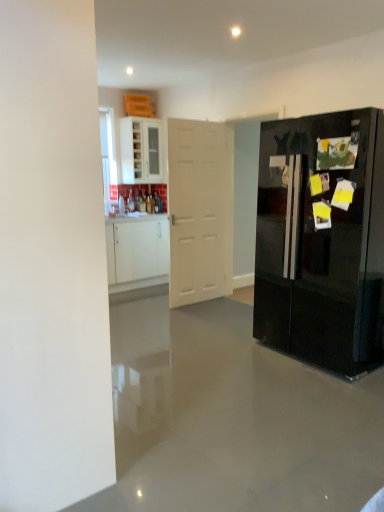
Question: Relative to glossy black refrigerator at right, is white matte door at center in front or behind?

Choices:
 (A) front
 (B) behind

Answer: (B)

Question: From the image's perspective, relative to glossy black refrigerator at right, is white matte door at center above or below?

Choices:
 (A) below
 (B) above

Answer: (B)

Question: Estimate the real-world distances between objects in this image. Which object is closer to the white matte door at center?

Choices:
 (A) white glossy cabinet at upper left
 (B) glossy black refrigerator at right

Answer: (B)

Question: Which object is the closest to the white matte door at center?

Choices:
 (A) white glossy cabinet at upper left
 (B) glossy black refrigerator at right

Answer: (B)